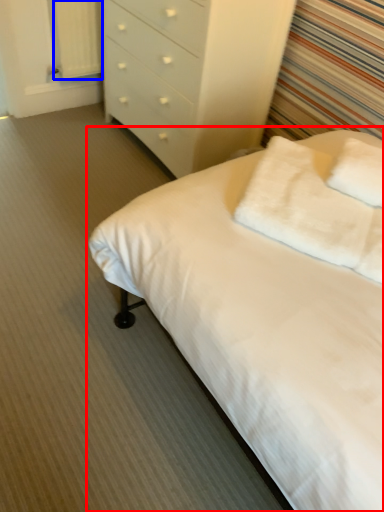
Question: Which point is closer to the camera, bed (highlighted by a red box) or curtain (highlighted by a blue box)?

Choices:
 (A) bed
 (B) curtain

Answer: (A)